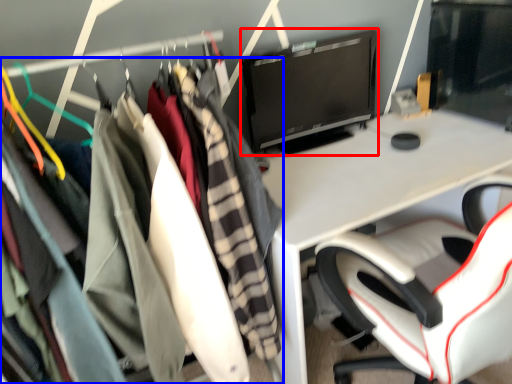
Question: Which object appears closest to the camera in this image, computer monitor (highlighted by a red box) or clothing (highlighted by a blue box)?

Choices:
 (A) computer monitor
 (B) clothing

Answer: (B)